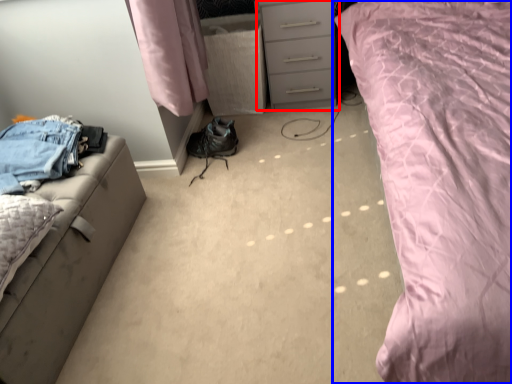
Question: Which object is further to the camera taking this photo, chest of drawers (highlighted by a red box) or bed (highlighted by a blue box)?

Choices:
 (A) chest of drawers
 (B) bed

Answer: (A)